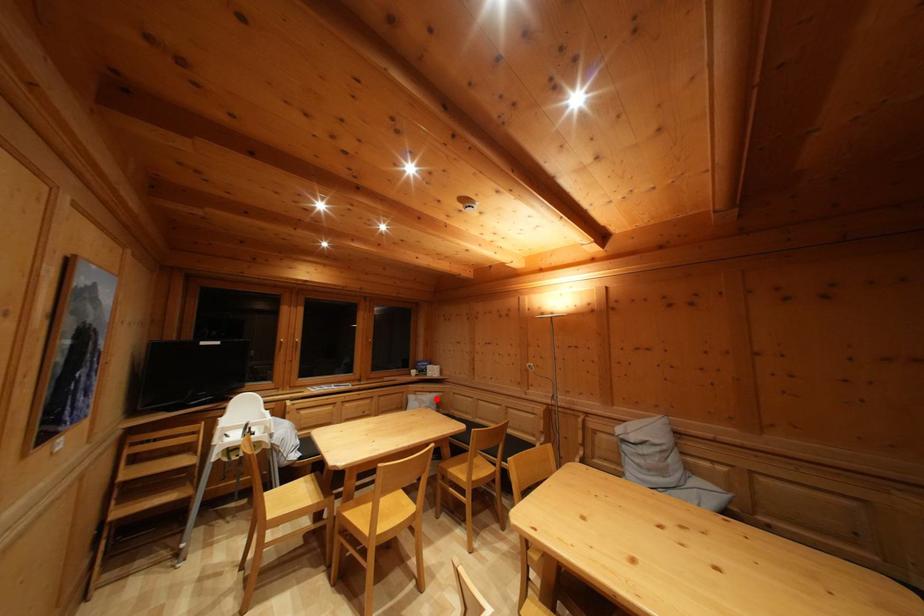
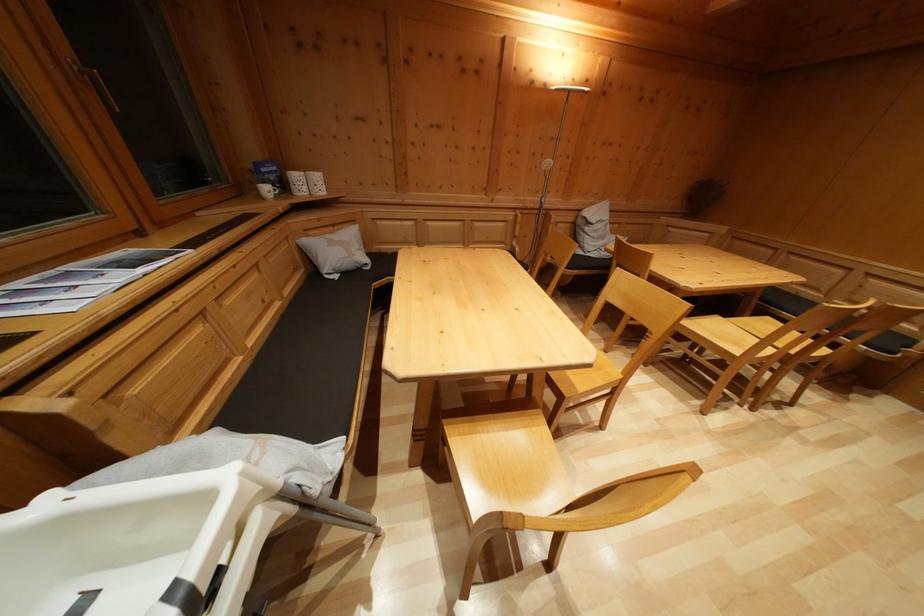
Locate, in the second image, the point that corresponds to the highlighted location in the first image.

(338, 233)